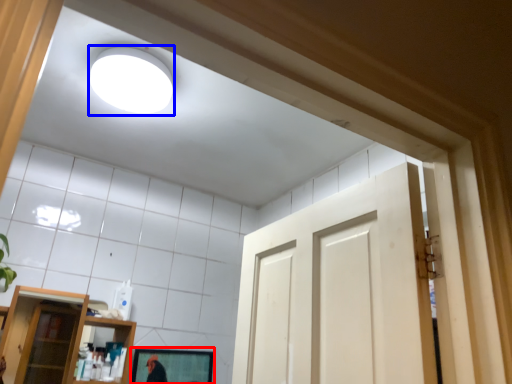
Question: Which object is closer to the camera taking this photo, mirror (highlighted by a red box) or lighting (highlighted by a blue box)?

Choices:
 (A) mirror
 (B) lighting

Answer: (B)